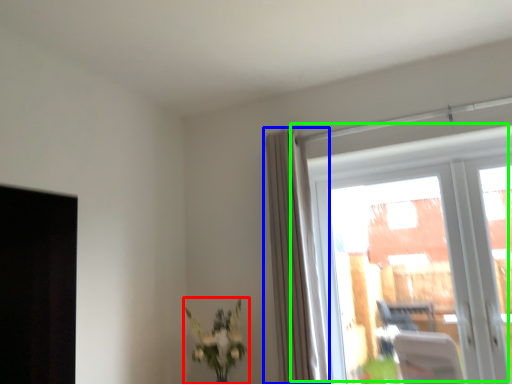
Question: Estimate the real-world distances between objects in this image. Which object is farther from houseplant (highlighted by a red box), curtain (highlighted by a blue box) or window (highlighted by a green box)?

Choices:
 (A) curtain
 (B) window

Answer: (B)